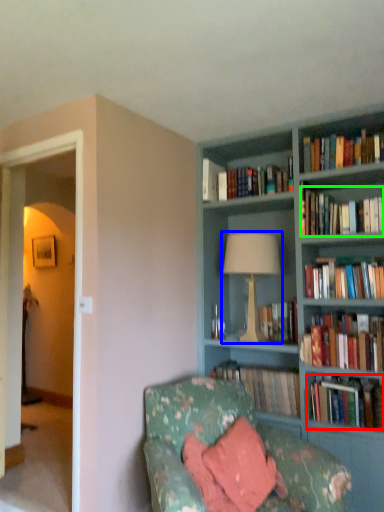
Question: Which object is positioned closest to book (highlighted by a red box)? Select from table lamp (highlighted by a blue box) and book (highlighted by a green box).

Choices:
 (A) table lamp
 (B) book

Answer: (A)